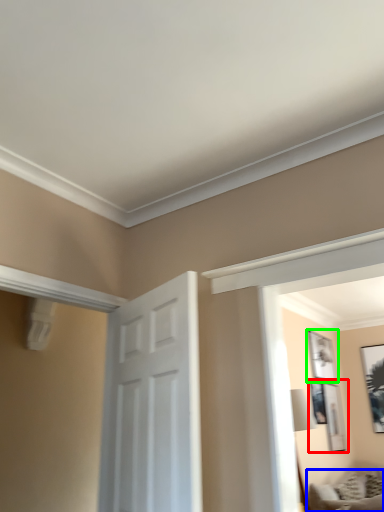
Question: Which object is positioned farthest from picture frame (highlighted by a red box)? Select from furniture (highlighted by a blue box) and picture frame (highlighted by a green box).

Choices:
 (A) furniture
 (B) picture frame

Answer: (A)